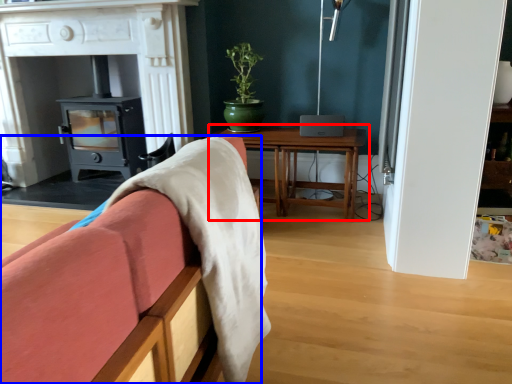
Question: Which of the following is the farthest to the observer, table (highlighted by a red box) or furniture (highlighted by a blue box)?

Choices:
 (A) table
 (B) furniture

Answer: (A)